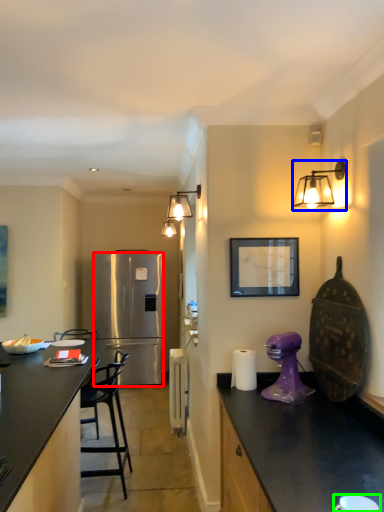
Question: Which object is the farthest from refrigerator (highlighted by a red box)? Choose among these: light fixture (highlighted by a blue box) or coffee cup (highlighted by a green box).

Choices:
 (A) light fixture
 (B) coffee cup

Answer: (B)